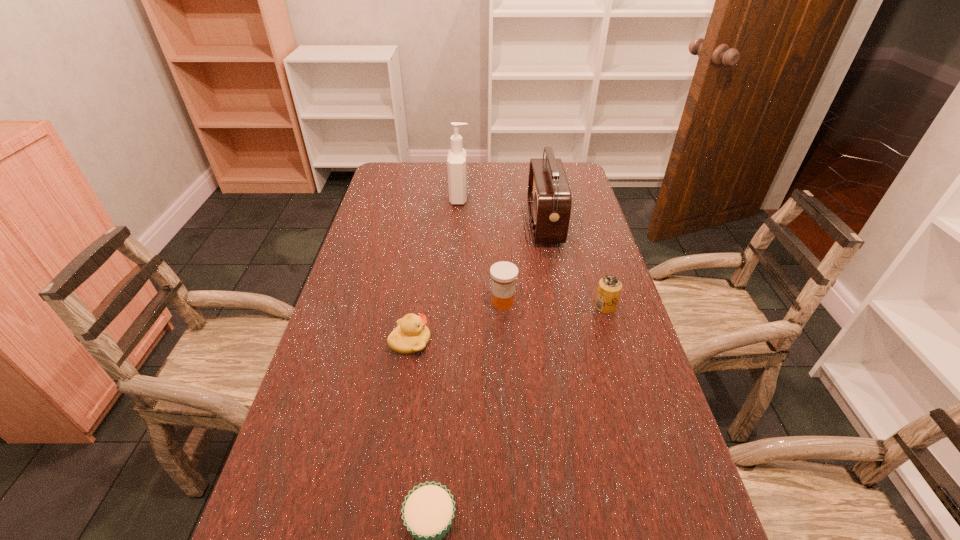
The height and width of the screenshot is (540, 960). Identify the location of free region that satisfies the following two spatial constraints: 1. on the back side of the rightmost object; 2. on the front panel of the fifth shortest object. (580, 224).

Identify the location of vacant space that satisfies the following two spatial constraints: 1. on the back side of the beer can; 2. on the front panel of the fifth object from left to right. The height and width of the screenshot is (540, 960). (580, 224).

Locate an element on the screen. This screenshot has width=960, height=540. free space that satisfies the following two spatial constraints: 1. on the front panel of the beer can; 2. on the right side of the second object from right to left is located at coordinates (560, 307).